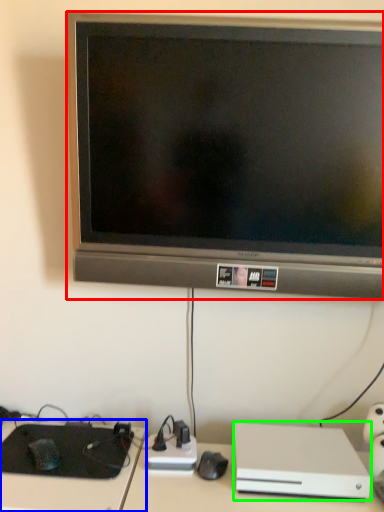
Question: Estimate the real-world distances between objects in this image. Which object is closer to television (highlighted by a red box), computer desk (highlighted by a blue box) or computer (highlighted by a green box)?

Choices:
 (A) computer desk
 (B) computer

Answer: (B)